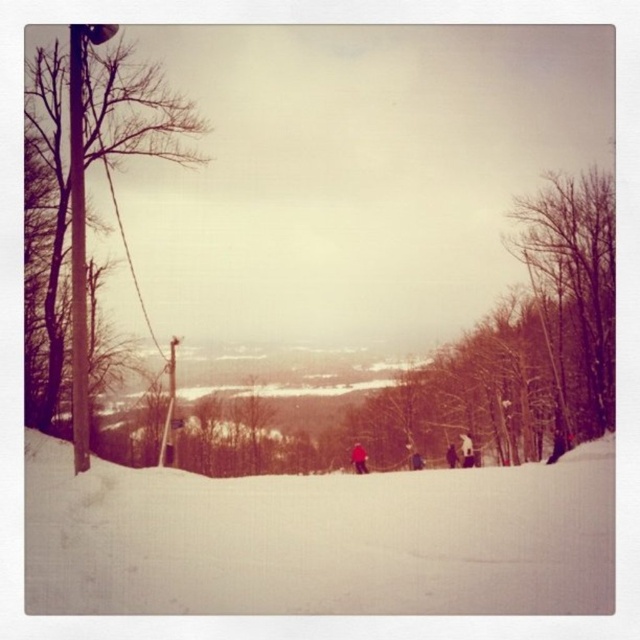
You are a photographer setting up a shot at the ski resort. You have a camera with a 1.8m focal length lens. The bare wood pole at left and the red fabric jacket at center are both in your frame. Which object will appear larger in your photo?

The bare wood pole at left is taller than the red fabric jacket at center, so it will appear larger in the photo.

You are a photographer trying to capture the bare branches at right in your shot. If you want to position them exactly at the center of the image, which direction should you move your camera? The image uses a coordinate system where the bottom left corner is the origin point.

The bare branches at right are currently at coordinate point (573, 284). To center them at coordinate point (320, 320), you should move the camera slightly to the left and down.